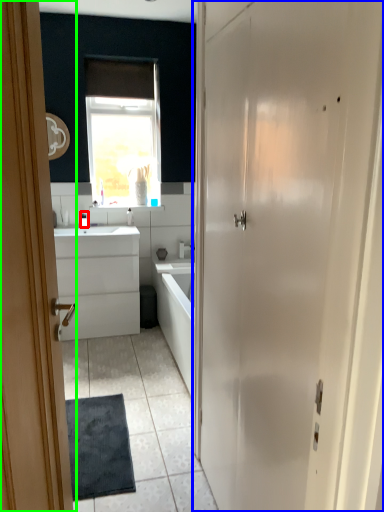
Question: Which object is positioned farthest from toiletry (highlighted by a red box)? Select from door (highlighted by a blue box) and door (highlighted by a green box).

Choices:
 (A) door
 (B) door

Answer: (A)